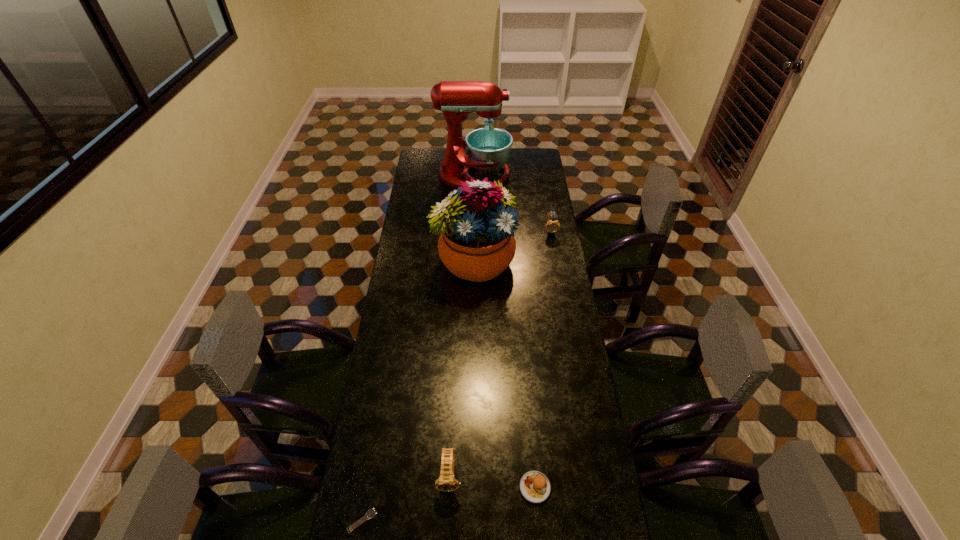
You are a GUI agent. You are given a task and a screenshot of the screen. Output one action in this format:
    pyautogui.click(x=<x>, y=<y>)
    Task: Click on the vacant space that is in between the rightmost object and the leftmost watch
    
    Given the screenshot: What is the action you would take?
    pyautogui.click(x=457, y=375)

The image size is (960, 540). I want to click on free area in between the patty and the mixer, so pyautogui.click(x=504, y=332).

Find the location of a particular element. free area in between the second nearest watch and the second tallest object is located at coordinates (462, 368).

Select which object is the closest to the leftmost object. Please provide its 2D coordinates. Your answer should be formatted as a tuple, i.e. [(x, y)], where the tuple contains the x and y coordinates of a point satisfying the conditions above.

[(446, 482)]

Choose which object is the third nearest neighbor to the second watch from right to left. Please provide its 2D coordinates. Your answer should be formatted as a tuple, i.e. [(x, y)], where the tuple contains the x and y coordinates of a point satisfying the conditions above.

[(477, 243)]

Locate which watch is the second closest to the leftmost object. Please provide its 2D coordinates. Your answer should be formatted as a tuple, i.e. [(x, y)], where the tuple contains the x and y coordinates of a point satisfying the conditions above.

[(552, 226)]

The image size is (960, 540). In order to click on the closest watch to the second farthest watch in this screenshot , I will do `click(371, 513)`.

Identify the location of free space that satisfies the following two spatial constraints: 1. on the face of the patty; 2. on the right side of the second watch from right to left. (x=449, y=487).

Locate an element on the screen. free space that satisfies the following two spatial constraints: 1. on the front-facing side of the mixer; 2. on the face of the second farthest watch is located at coordinates (468, 476).

What are the coordinates of `free location that satisfies the following two spatial constraints: 1. on the back side of the patty; 2. on the front-facing side of the tallest object` in the screenshot? It's located at (510, 176).